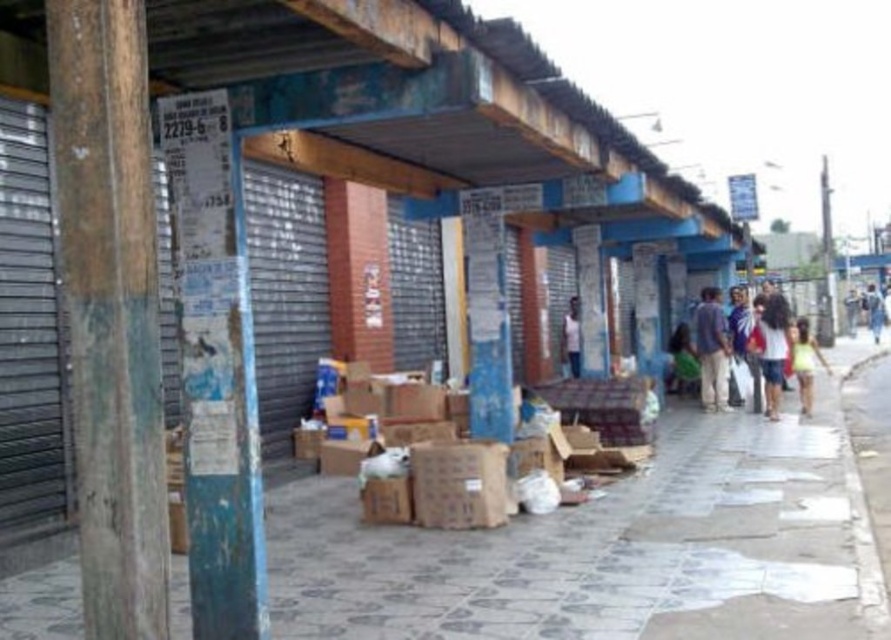
Is point (685, 636) closer to viewer compared to point (772, 292)?

That is True.

In the scene shown: Can you confirm if gray concrete pavement at center is smaller than white cotton shirt at right?

Incorrect, gray concrete pavement at center is not smaller in size than white cotton shirt at right.

What do you see at coordinates (605, 550) in the screenshot? I see `gray concrete pavement at center` at bounding box center [605, 550].

You are a GUI agent. You are given a task and a screenshot of the screen. Output one action in this format:
    pyautogui.click(x=<x>, y=<y>)
    Task: Click on the gray concrete pavement at center
    Image resolution: width=891 pixels, height=640 pixels.
    Given the screenshot: What is the action you would take?
    (x=605, y=550)

Between gray concrete pavement at center and light blue denim shorts at lower right, which one is positioned lower?

Positioned lower is gray concrete pavement at center.

Looking at this image, measure the distance between point (576, 628) and camera.

They are 16.52 feet apart.

Identify the location of gray concrete pavement at center. (605, 550).

Who is positioned more to the left, gray concrete pavement at center or weathered wood pole at left?

weathered wood pole at left

Find the location of `gray concrete pavement at center`. gray concrete pavement at center is located at coordinates (605, 550).